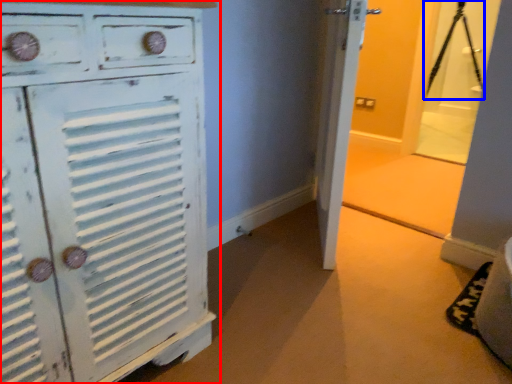
Question: Which object is closer to the camera taking this photo, chest of drawers (highlighted by a red box) or tripod (highlighted by a blue box)?

Choices:
 (A) chest of drawers
 (B) tripod

Answer: (A)